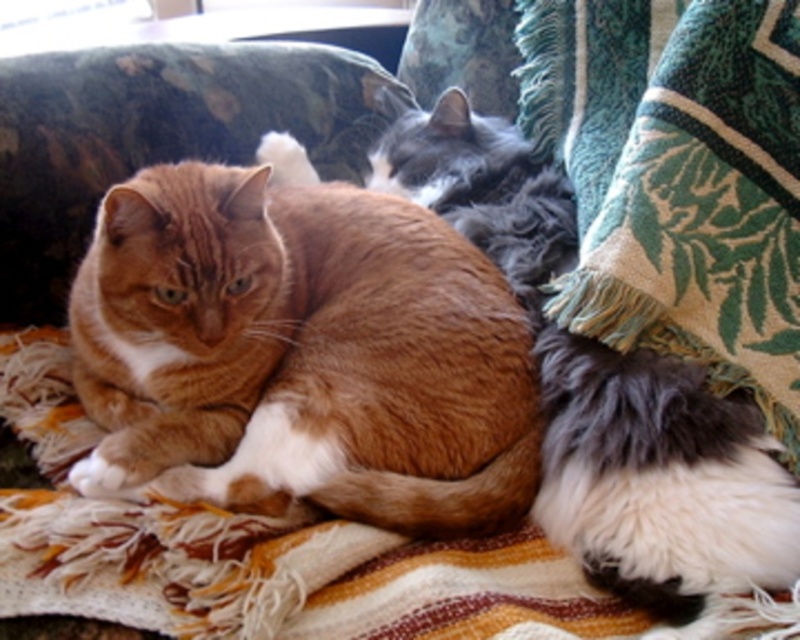
Is orange tabby cat at center further to camera compared to green woven blanket at lower right?

Yes, orange tabby cat at center is behind green woven blanket at lower right.

Who is shorter, orange tabby cat at center or green woven blanket at lower right?

Standing shorter between the two is orange tabby cat at center.

At what (x,y) coordinates should I click in order to perform the action: click on orange tabby cat at center. Please return your answer as a coordinate pair (x, y). Looking at the image, I should click on (300, 353).